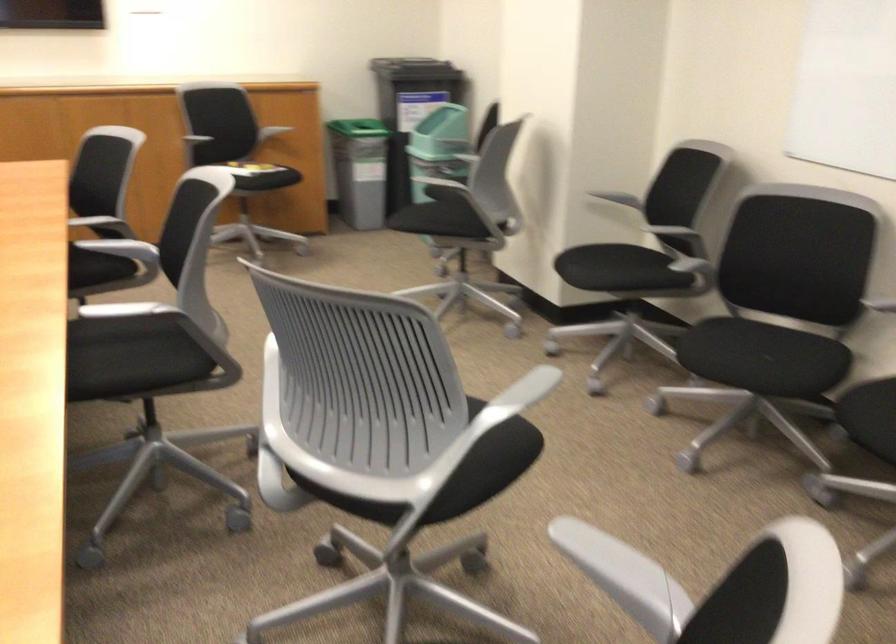
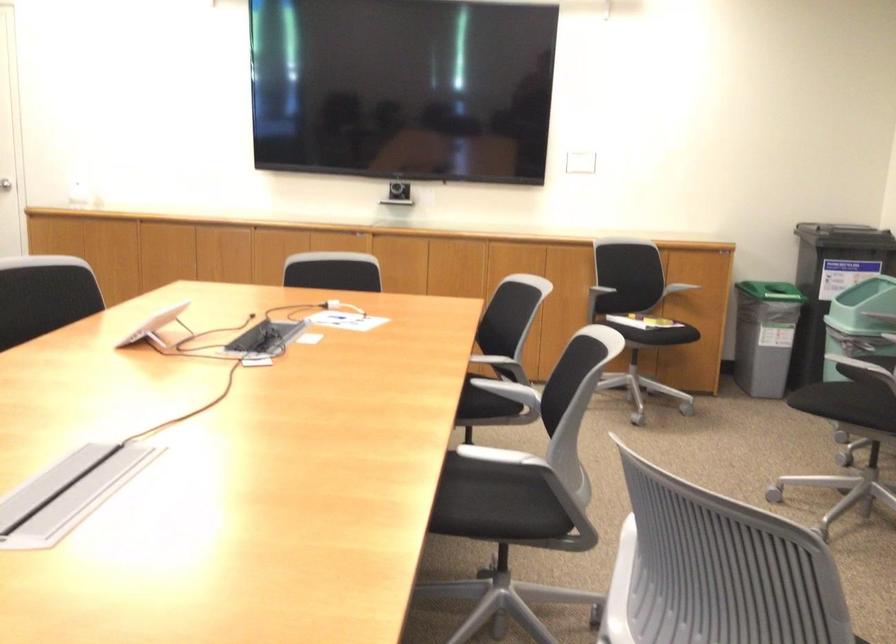
The point at (277, 131) is marked in the first image. Where is the corresponding point in the second image?

(673, 285)